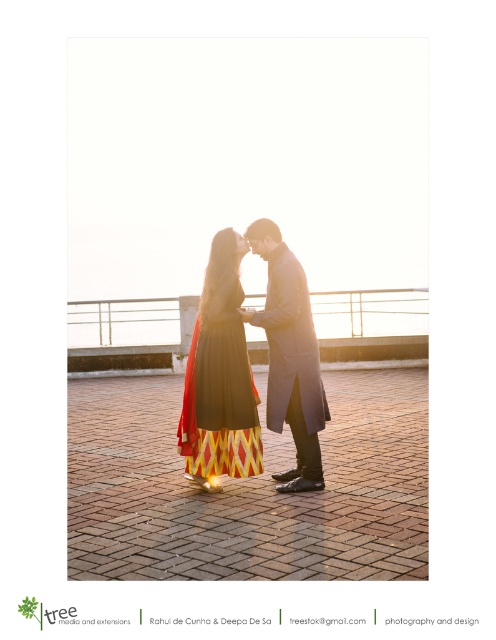
Question: Does matte black dress at center appear over black matte dress at center?

Choices:
 (A) no
 (B) yes

Answer: (B)

Question: Which of the following is the farthest from the observer?

Choices:
 (A) black matte dress at center
 (B) matte black dress at center

Answer: (B)

Question: Which point is farther from the camera taking this photo?

Choices:
 (A) coord(215,390)
 (B) coord(223,369)

Answer: (B)

Question: Does matte black dress at center appear over black matte dress at center?

Choices:
 (A) no
 (B) yes

Answer: (B)

Question: In this image, where is matte black dress at center located relative to black matte dress at center?

Choices:
 (A) left
 (B) right

Answer: (A)